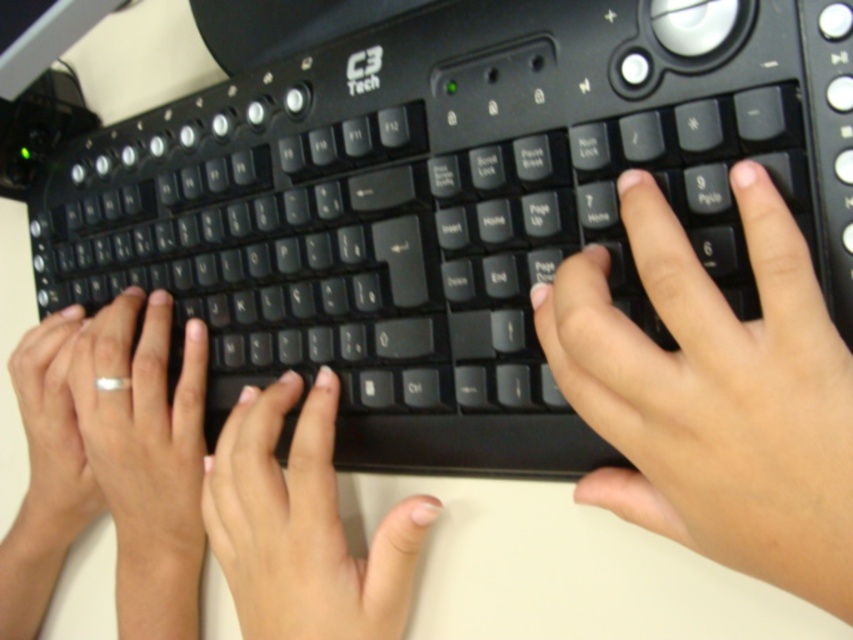
Between black matte hand at right and white matte ring at left, which one appears on the left side from the viewer's perspective?

white matte ring at left

Locate an element on the screen. Image resolution: width=853 pixels, height=640 pixels. black matte hand at right is located at coordinates (715, 394).

Find the location of `black matte hand at right`. black matte hand at right is located at coordinates point(715,394).

Where is `black matte hand at right`? The height and width of the screenshot is (640, 853). black matte hand at right is located at coordinates (715, 394).

Is point (795, 470) farther from camera compared to point (257, 419)?

No, it is not.

Is black matte hand at right thinner than matte black fingers at center?

Indeed, black matte hand at right has a lesser width compared to matte black fingers at center.

This screenshot has height=640, width=853. Find the location of `black matte hand at right`. black matte hand at right is located at coordinates [x=715, y=394].

Looking at this image, how far apart are black matte keyboard at center and black matte hand at right?

black matte keyboard at center and black matte hand at right are 5.97 inches apart.

Does black matte keyboard at center have a lesser height compared to black matte hand at right?

No.

Does point (402, 76) come in front of point (624, 316)?

No.

Identify the location of black matte keyboard at center. This screenshot has width=853, height=640. (450, 205).